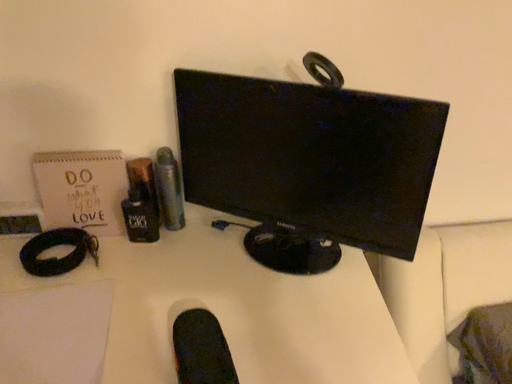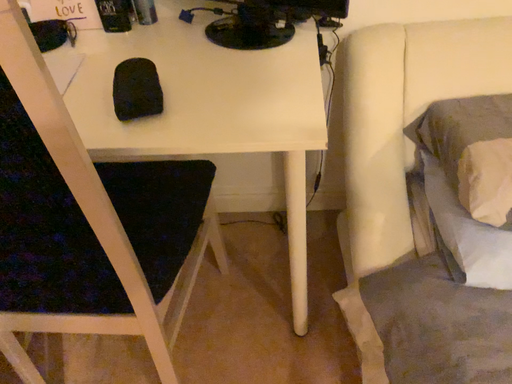
Question: How did the camera likely rotate when shooting the video?

Choices:
 (A) rotated left
 (B) rotated right

Answer: (A)